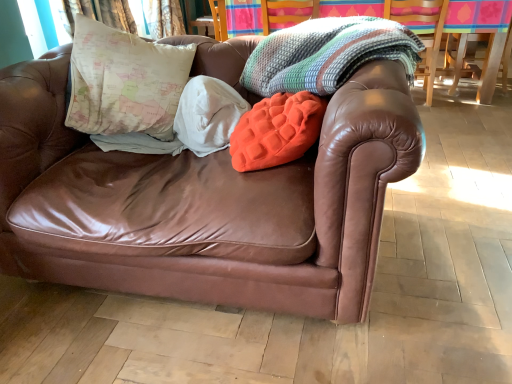
This screenshot has height=384, width=512. What do you see at coordinates (277, 131) in the screenshot?
I see `orange fuzzy pillow at center` at bounding box center [277, 131].

Describe the element at coordinates (204, 203) in the screenshot. The image size is (512, 384). I see `brown leather couch at center` at that location.

At what (x,y) coordinates should I click in order to perform the action: click on knitted multicolored blanket at upper center. Please return your answer as a coordinate pair (x, y). The width and height of the screenshot is (512, 384). Looking at the image, I should click on point(286,15).

Locate an element on the screen. wooden swivel chair at upper right is located at coordinates [x=477, y=39].

The height and width of the screenshot is (384, 512). Describe the element at coordinates (327, 54) in the screenshot. I see `knitted multicolor blanket at upper center, marked as the 2th blanket in a left-to-right arrangement` at that location.

Image resolution: width=512 pixels, height=384 pixels. I want to click on map-patterned fabric pillow at upper left, so click(124, 82).

Between orange fuzzy pillow at center and knitted multicolor blanket at upper center, marked as the 1th blanket in a right-to-left arrangement, which one is positioned in front?

knitted multicolor blanket at upper center, marked as the 1th blanket in a right-to-left arrangement, is closer to the camera.

Between point (302, 105) and point (286, 57), which one is positioned behind?

Positioned behind is point (286, 57).

From a real-world perspective, relative to knitted multicolor blanket at upper center, marked as the 2th blanket in a left-to-right arrangement, is orange fuzzy pillow at center vertically above or below?

orange fuzzy pillow at center is below knitted multicolor blanket at upper center, marked as the 2th blanket in a left-to-right arrangement.

Can we say orange fuzzy pillow at center lies outside knitted multicolor blanket at upper center, marked as the 1th blanket in a right-to-left arrangement?

That's correct, orange fuzzy pillow at center is outside of knitted multicolor blanket at upper center, marked as the 1th blanket in a right-to-left arrangement.

Are wooden swivel chair at upper right and orange fuzzy pillow at center making contact?

No.

Does wooden swivel chair at upper right have a larger size compared to orange fuzzy pillow at center?

Yes.

Is wooden swivel chair at upper right oriented away from orange fuzzy pillow at center?

wooden swivel chair at upper right is not turned away from orange fuzzy pillow at center.

In the scene shown: Are knitted multicolored blanket at upper center and wooden swivel chair at upper right located far from each other?

Yes.

From a real-world perspective, is knitted multicolored blanket at upper center above or below wooden swivel chair at upper right?

knitted multicolored blanket at upper center is situated higher than wooden swivel chair at upper right in the real world.

Measure the distance from knitted multicolored blanket at upper center to wooden swivel chair at upper right.

knitted multicolored blanket at upper center is 3.59 feet away from wooden swivel chair at upper right.

Is knitted multicolored blanket at upper center wider than wooden swivel chair at upper right?

Correct, the width of knitted multicolored blanket at upper center exceeds that of wooden swivel chair at upper right.

From the image's perspective, is knitted multicolor blanket at upper center, marked as the 2th blanket in a left-to-right arrangement, under knitted multicolored blanket at upper center?

Correct, knitted multicolor blanket at upper center, marked as the 2th blanket in a left-to-right arrangement, appears lower than knitted multicolored blanket at upper center in the image.

Can knitted multicolored blanket at upper center be found inside knitted multicolor blanket at upper center, marked as the 2th blanket in a left-to-right arrangement?

No, knitted multicolored blanket at upper center is not inside knitted multicolor blanket at upper center, marked as the 2th blanket in a left-to-right arrangement.

Which object is positioned more to the right, knitted multicolor blanket at upper center, marked as the 2th blanket in a left-to-right arrangement, or knitted multicolored blanket at upper center?

From the viewer's perspective, knitted multicolored blanket at upper center appears more on the right side.

How far apart are knitted multicolor blanket at upper center, marked as the 1th blanket in a right-to-left arrangement, and knitted multicolored blanket at upper center?

knitted multicolor blanket at upper center, marked as the 1th blanket in a right-to-left arrangement, is 4.91 feet away from knitted multicolored blanket at upper center.

Which object is wider, knitted multicolor blanket at upper center, marked as the 1th blanket in a right-to-left arrangement, or orange fuzzy pillow at center?

With larger width is knitted multicolor blanket at upper center, marked as the 1th blanket in a right-to-left arrangement.

Is knitted multicolor blanket at upper center, marked as the 2th blanket in a left-to-right arrangement, in contact with orange fuzzy pillow at center?

No, knitted multicolor blanket at upper center, marked as the 2th blanket in a left-to-right arrangement, is not touching orange fuzzy pillow at center.

Could you tell me if knitted multicolor blanket at upper center, marked as the 1th blanket in a right-to-left arrangement, is facing orange fuzzy pillow at center?

No, knitted multicolor blanket at upper center, marked as the 1th blanket in a right-to-left arrangement, is not aimed at orange fuzzy pillow at center.

The image size is (512, 384). Identify the location of blanket above the orange fuzzy pillow at center (from a real-world perspective). (327, 54).

From a real-world perspective, who is located higher, brown leather couch at center or knitted multicolored blanket at upper center?

knitted multicolored blanket at upper center is physically above.

Looking at this image, considering the relative sizes of brown leather couch at center and knitted multicolored blanket at upper center in the image provided, is brown leather couch at center thinner than knitted multicolored blanket at upper center?

No, brown leather couch at center is not thinner than knitted multicolored blanket at upper center.

Is brown leather couch at center inside the boundaries of knitted multicolored blanket at upper center, or outside?

brown leather couch at center cannot be found inside knitted multicolored blanket at upper center.

From the picture: Does brown leather couch at center turn towards knitted multicolored blanket at upper center?

No, brown leather couch at center is not oriented towards knitted multicolored blanket at upper center.

Would you say orange fuzzy pillow at center contains map-patterned fabric pillow at upper left?

No, map-patterned fabric pillow at upper left is not a part of orange fuzzy pillow at center.

Are orange fuzzy pillow at center and map-patterned fabric pillow at upper left far apart?

No, orange fuzzy pillow at center is not far away from map-patterned fabric pillow at upper left.

Looking at this image, who is taller, orange fuzzy pillow at center or map-patterned fabric pillow at upper left?

map-patterned fabric pillow at upper left.

Is orange fuzzy pillow at center looking in the opposite direction of map-patterned fabric pillow at upper left?

No, orange fuzzy pillow at center's orientation is not away from map-patterned fabric pillow at upper left.

Image resolution: width=512 pixels, height=384 pixels. I want to click on throw pillow below the knitted multicolor blanket at upper center, marked as the 2th blanket in a left-to-right arrangement (from the image's perspective), so click(277, 131).

I want to click on throw pillow on the left of wooden swivel chair at upper right, so click(x=277, y=131).

Looking at this image, estimate the real-world distances between objects in this image. Which object is closer to white soft blanket at center, marked as the first blanket in a left-to-right arrangement, map-patterned fabric pillow at upper left or knitted multicolored blanket at upper center?

map-patterned fabric pillow at upper left is positioned closer to the anchor white soft blanket at center, marked as the first blanket in a left-to-right arrangement.

Considering their positions, is map-patterned fabric pillow at upper left positioned closer to orange fuzzy pillow at center than brown leather couch at center?

brown leather couch at center is closer to orange fuzzy pillow at center.

Estimate the real-world distances between objects in this image. Which object is further from map-patterned fabric pillow at upper left, brown leather couch at center or white soft blanket at center, the 2th blanket viewed from the right?

brown leather couch at center is further to map-patterned fabric pillow at upper left.

Considering their positions, is knitted multicolored blanket at upper center positioned closer to orange fuzzy pillow at center than wooden swivel chair at upper right?

knitted multicolored blanket at upper center lies closer to orange fuzzy pillow at center than the other object.

From the image, which object appears to be nearer to map-patterned fabric pillow at upper left, white soft blanket at center, the 2th blanket viewed from the right, or brown leather couch at center?

white soft blanket at center, the 2th blanket viewed from the right, lies closer to map-patterned fabric pillow at upper left than the other object.

Looking at the image, which one is located closer to brown leather couch at center, map-patterned fabric pillow at upper left or knitted multicolored blanket at upper center?

map-patterned fabric pillow at upper left lies closer to brown leather couch at center than the other object.

Looking at the image, which one is located further to map-patterned fabric pillow at upper left, orange fuzzy pillow at center or knitted multicolor blanket at upper center, marked as the 1th blanket in a right-to-left arrangement?

orange fuzzy pillow at center.

From the image, which object appears to be nearer to brown leather couch at center, wooden swivel chair at upper right or orange fuzzy pillow at center?

Based on the image, orange fuzzy pillow at center appears to be nearer to brown leather couch at center.

Locate an element on the screen. The height and width of the screenshot is (384, 512). armchair between white soft blanket at center, marked as the first blanket in a left-to-right arrangement, and wooden swivel chair at upper right from left to right is located at coordinates (286, 15).

Identify the location of armchair situated between map-patterned fabric pillow at upper left and wooden swivel chair at upper right from left to right. This screenshot has height=384, width=512. (286, 15).

At what (x,y) coordinates should I click in order to perform the action: click on blanket between map-patterned fabric pillow at upper left and knitted multicolored blanket at upper center from front to back. Please return your answer as a coordinate pair (x, y). Image resolution: width=512 pixels, height=384 pixels. Looking at the image, I should click on (189, 122).

I want to click on studio couch between map-patterned fabric pillow at upper left and knitted multicolor blanket at upper center, marked as the 1th blanket in a right-to-left arrangement, from left to right, so click(x=204, y=203).